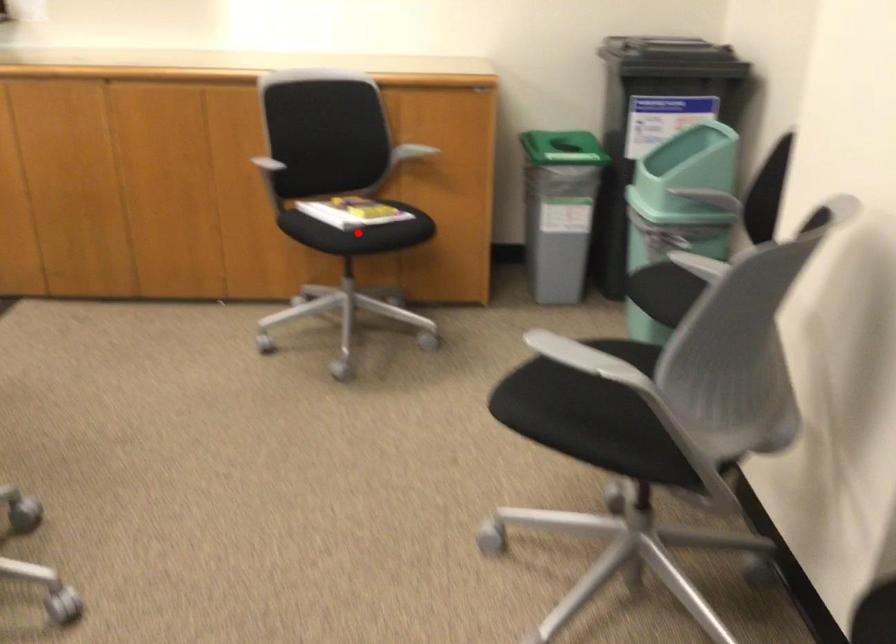
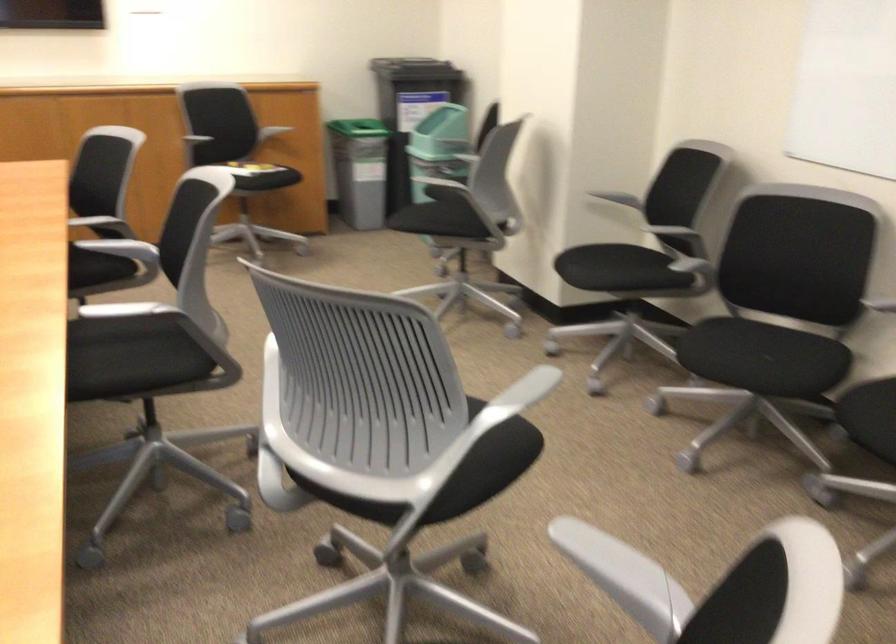
Question: I am providing you with two images of the same scene from different viewpoints. A red point is marked on the first image. At the location where the point appears in image 1, is it still visible in image 2?

Choices:
 (A) Yes
 (B) No

Answer: (B)